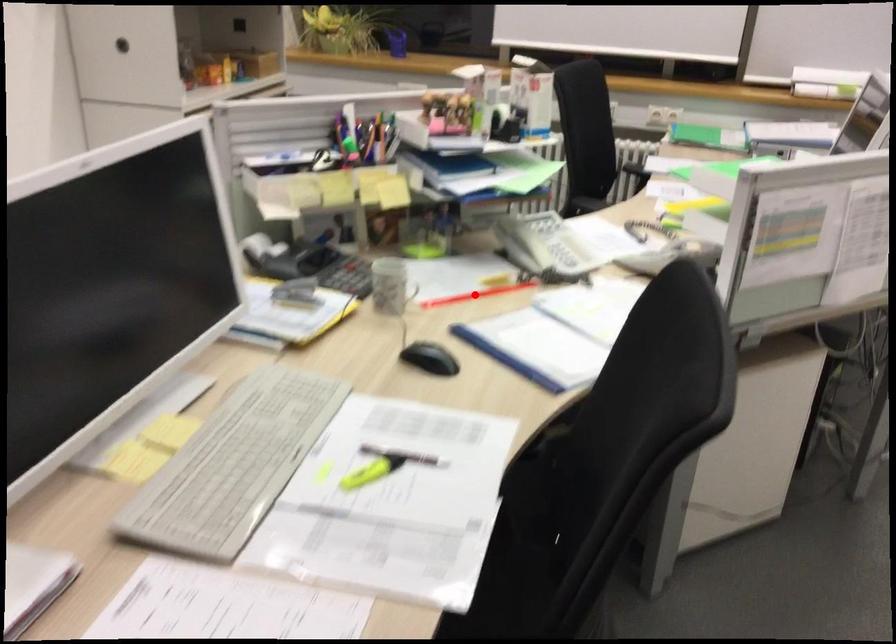
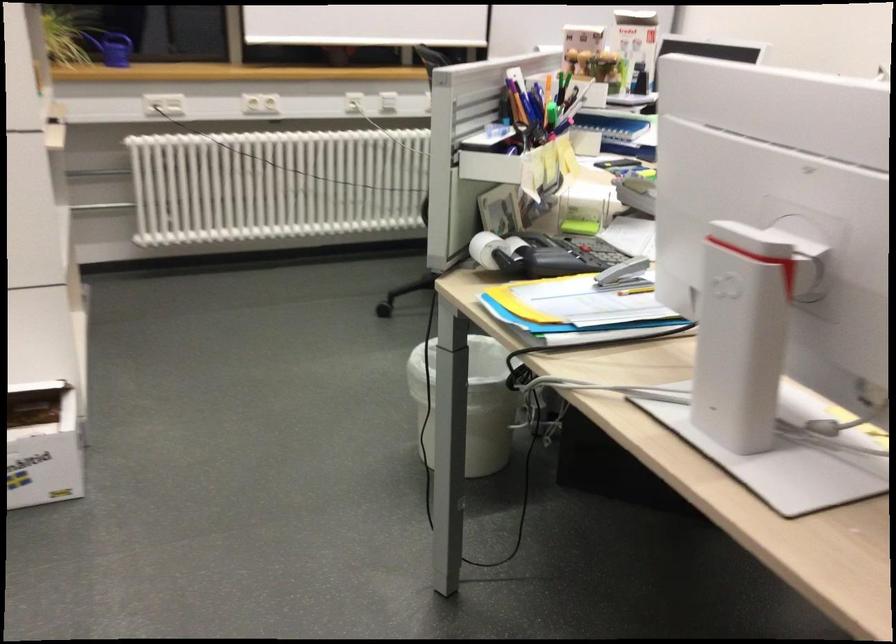
Question: I am providing you with two images of the same scene from different viewpoints. A red point is marked on the first image. Can you still see the location of the red point in image 2?

Choices:
 (A) Yes
 (B) No

Answer: (B)